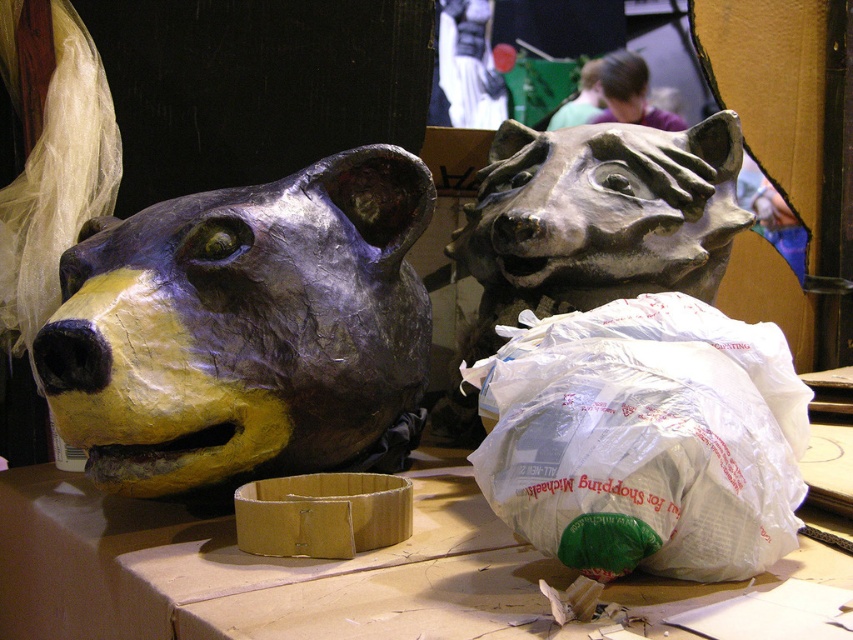
Does white plastic bag at center have a smaller size compared to matte gray bear head at center?

Indeed, white plastic bag at center has a smaller size compared to matte gray bear head at center.

Describe the element at coordinates (646, 440) in the screenshot. I see `white plastic bag at center` at that location.

Is point (692, 481) farther from viewer compared to point (537, 218)?

No.

The width and height of the screenshot is (853, 640). In order to click on white plastic bag at center in this screenshot , I will do `click(646, 440)`.

Can you confirm if matte papier-mâché bear head at left is thinner than matte cardboard table at center?

Indeed, matte papier-mâché bear head at left has a lesser width compared to matte cardboard table at center.

How much distance is there between matte papier-mâché bear head at left and matte cardboard table at center?

matte papier-mâché bear head at left is 17.07 inches away from matte cardboard table at center.

Which is behind, point (392, 392) or point (532, 579)?

Point (392, 392)

You are a GUI agent. You are given a task and a screenshot of the screen. Output one action in this format:
    pyautogui.click(x=<x>, y=<y>)
    Task: Click on the matte papier-mâché bear head at left
    Image resolution: width=853 pixels, height=640 pixels.
    Given the screenshot: What is the action you would take?
    pyautogui.click(x=242, y=326)

Looking at this image, does matte papier-mâché bear head at left have a larger size compared to matte gray bear head at center?

Actually, matte papier-mâché bear head at left might be smaller than matte gray bear head at center.

Does matte papier-mâché bear head at left come behind matte gray bear head at center?

No, matte papier-mâché bear head at left is in front of matte gray bear head at center.

Describe the element at coordinates (242, 326) in the screenshot. I see `matte papier-mâché bear head at left` at that location.

Identify the location of matte papier-mâché bear head at left. (242, 326).